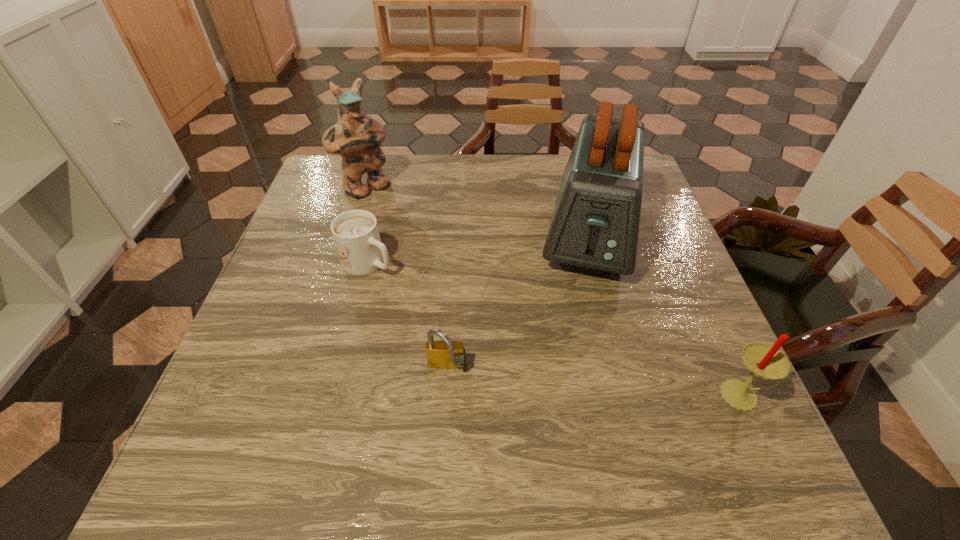
Where is `the third object from left to right`? the third object from left to right is located at coordinates (446, 354).

What are the coordinates of `the rightmost object` in the screenshot? It's located at (763, 360).

I want to click on the third shortest object, so click(x=763, y=360).

You are a GUI agent. You are given a task and a screenshot of the screen. Output one action in this format:
    pyautogui.click(x=<x>, y=<y>)
    Task: Click on the toaster
    This screenshot has width=960, height=540.
    Given the screenshot: What is the action you would take?
    pyautogui.click(x=595, y=223)

Image resolution: width=960 pixels, height=540 pixels. I want to click on figurine, so click(356, 137).

Locate an element on the screen. This screenshot has height=540, width=960. cappuccino is located at coordinates (355, 232).

Image resolution: width=960 pixels, height=540 pixels. I want to click on free space located on the side with the combination dials of the third object from left to right, so click(444, 410).

Identify the location of vacant space located on the left of the third shortest object. The image size is (960, 540). (691, 395).

Where is `vacant space situated on the front-facing side of the toaster`? This screenshot has width=960, height=540. vacant space situated on the front-facing side of the toaster is located at coordinates (578, 358).

The width and height of the screenshot is (960, 540). What are the coordinates of `vacant area situated on the front-facing side of the toaster` in the screenshot? It's located at (573, 389).